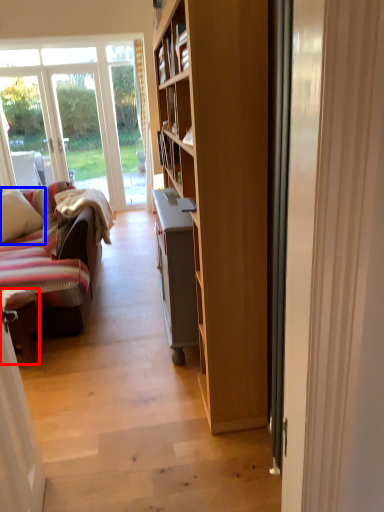
Question: Which point is closer to the camera, chair (highlighted by a red box) or pillow (highlighted by a blue box)?

Choices:
 (A) chair
 (B) pillow

Answer: (A)